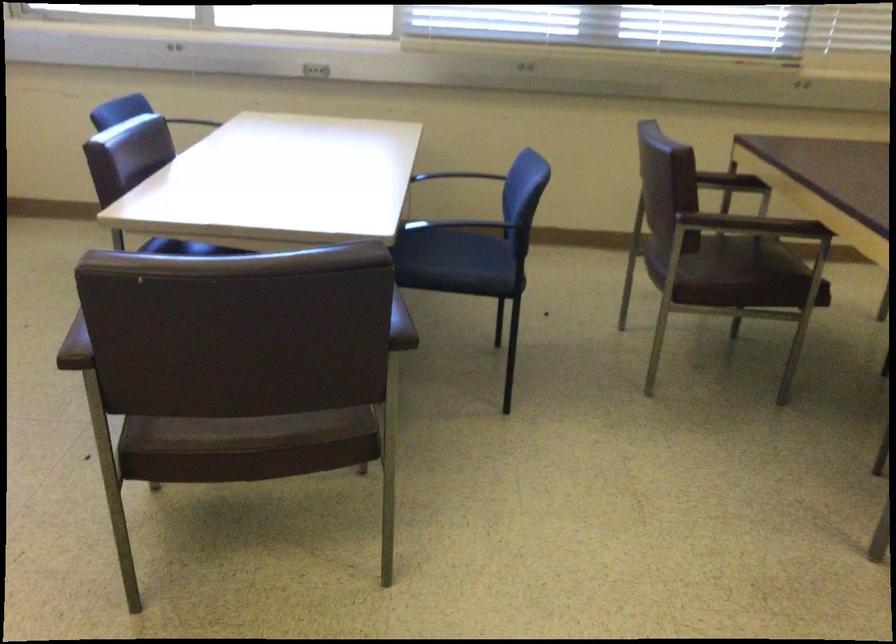
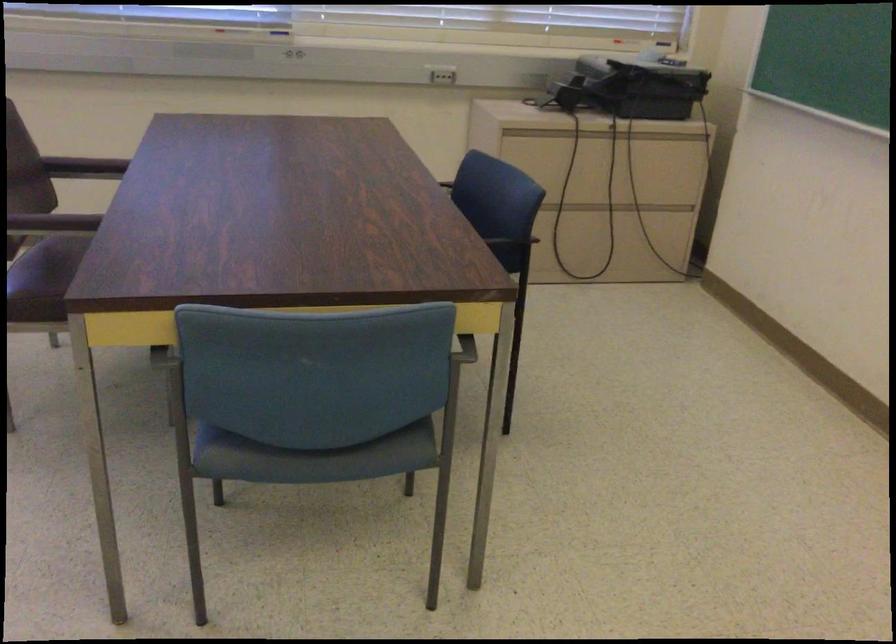
Question: What movement of the cameraman would produce the second image?

Choices:
 (A) Left
 (B) Right
 (C) Forward
 (D) Backward

Answer: (B)